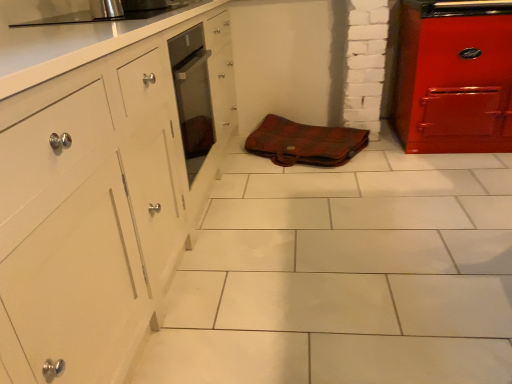
Question: Should I look upward or downward to see brown leather bag at center?

Choices:
 (A) up
 (B) down

Answer: (A)

Question: Can brushed metal oven at upper center be found inside brown leather bag at center?

Choices:
 (A) yes
 (B) no

Answer: (B)

Question: Does brown leather bag at center have a greater height compared to brushed metal oven at upper center?

Choices:
 (A) yes
 (B) no

Answer: (B)

Question: Is the position of brown leather bag at center more distant than that of brushed metal oven at upper center?

Choices:
 (A) no
 (B) yes

Answer: (B)

Question: From the image's perspective, is brown leather bag at center located beneath brushed metal oven at upper center?

Choices:
 (A) no
 (B) yes

Answer: (B)

Question: Does brown leather bag at center have a lesser width compared to brushed metal oven at upper center?

Choices:
 (A) no
 (B) yes

Answer: (A)

Question: From the image's perspective, does brown leather bag at center appear higher than brushed metal oven at upper center?

Choices:
 (A) no
 (B) yes

Answer: (A)

Question: Considering the relative sizes of brushed metal oven at upper center and brown leather bag at center in the image provided, is brushed metal oven at upper center wider than brown leather bag at center?

Choices:
 (A) no
 (B) yes

Answer: (A)

Question: Is brushed metal oven at upper center to the left of brown leather bag at center from the viewer's perspective?

Choices:
 (A) yes
 (B) no

Answer: (A)

Question: Is brushed metal oven at upper center bigger than brown leather bag at center?

Choices:
 (A) no
 (B) yes

Answer: (A)

Question: Does brushed metal oven at upper center lie behind brown leather bag at center?

Choices:
 (A) no
 (B) yes

Answer: (A)

Question: From the image's perspective, is brushed metal oven at upper center below brown leather bag at center?

Choices:
 (A) no
 (B) yes

Answer: (A)

Question: Is the depth of brushed metal oven at upper center less than that of brown leather bag at center?

Choices:
 (A) yes
 (B) no

Answer: (A)

Question: Is point (118, 3) closer or farther from the camera than point (325, 160)?

Choices:
 (A) closer
 (B) farther

Answer: (A)